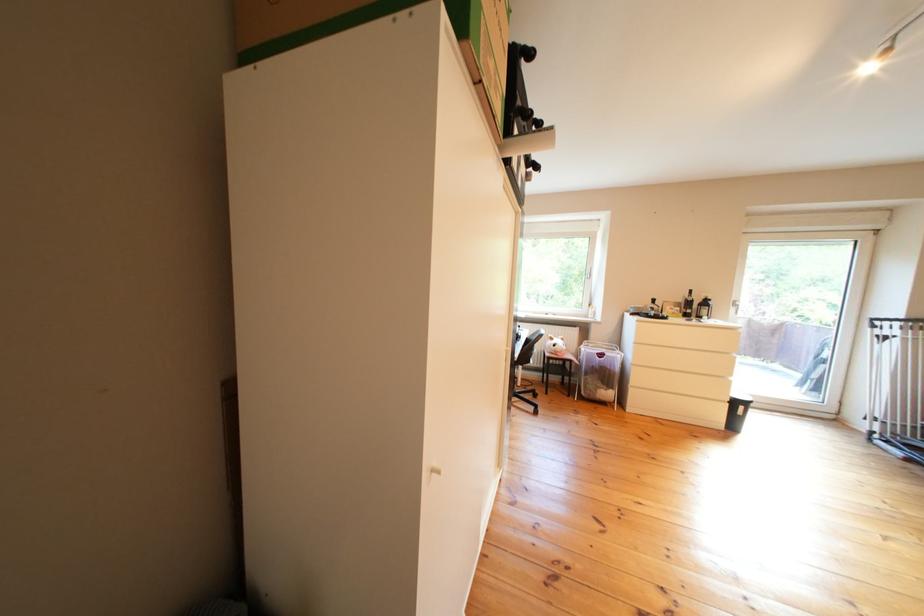
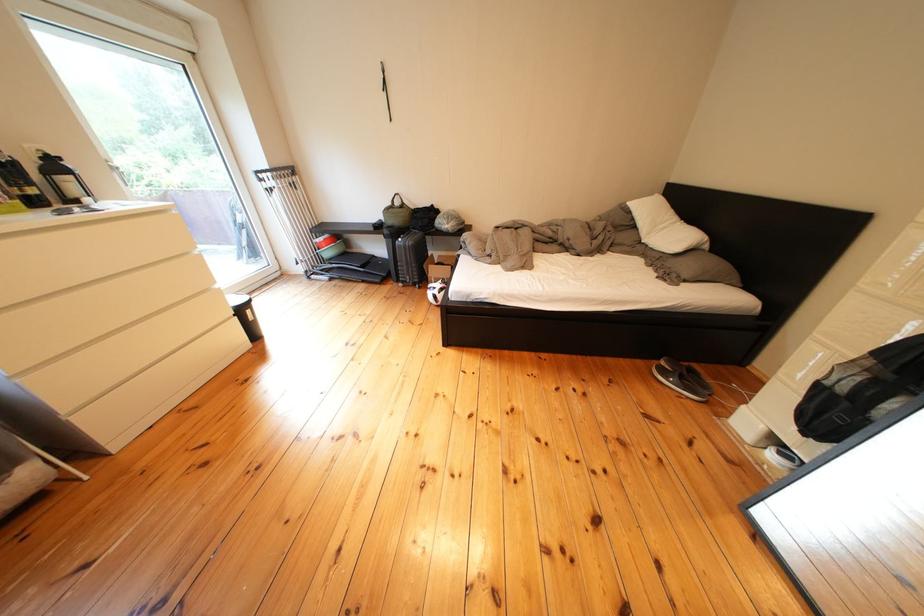
Locate, in the second image, the point that corresponds to (829,381) in the first image.

(259, 248)